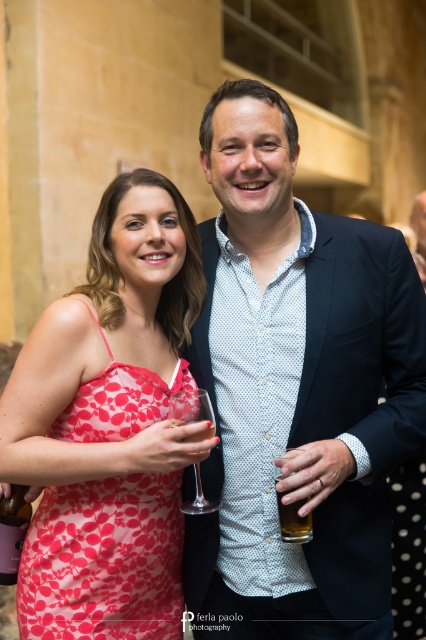
Question: Is floral print fabric dress at left above clear glass wine glass at center?

Choices:
 (A) yes
 (B) no

Answer: (B)

Question: Does matte blue shirt at center appear on the left side of clear glass wine at lower left?

Choices:
 (A) yes
 (B) no

Answer: (B)

Question: Which point is closer to the camera?

Choices:
 (A) (284, 516)
 (B) (325, 310)
 (C) (11, 516)
 (D) (63, 436)

Answer: (A)

Question: Is floral print fabric dress at left to the left of clear glass wine glass at center from the viewer's perspective?

Choices:
 (A) yes
 (B) no

Answer: (A)

Question: Among these objects, which one is farthest from the camera?

Choices:
 (A) translucent glass beer at center
 (B) clear glass wine at lower left
 (C) floral print fabric dress at left

Answer: (B)

Question: Which object is closer to the camera taking this photo?

Choices:
 (A) floral print fabric dress at left
 (B) clear glass wine at lower left
 (C) matte blue shirt at center
 (D) translucent glass beer at center

Answer: (C)